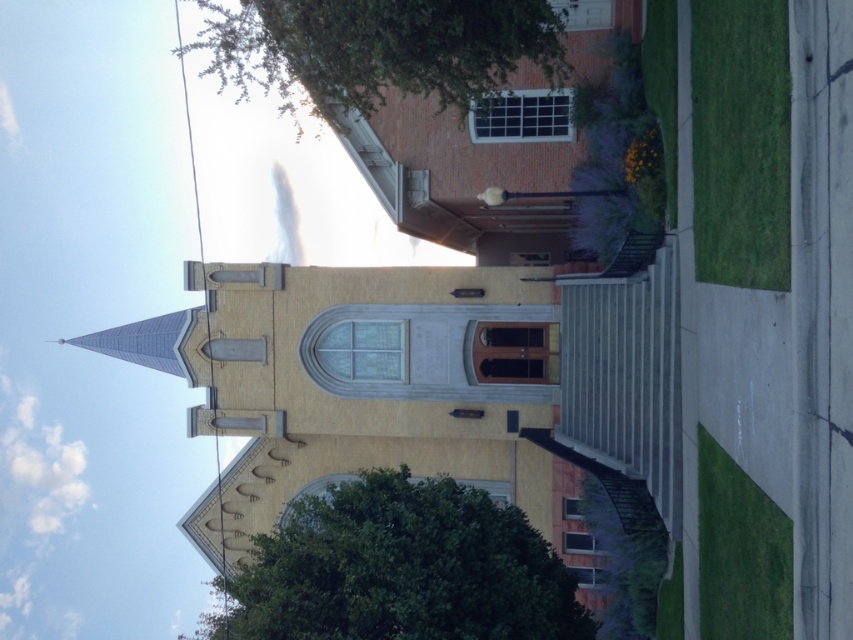
Is green leafy tree at center positioned before green leafy tree at upper center?

That is True.

This screenshot has width=853, height=640. What are the coordinates of `green leafy tree at center` in the screenshot? It's located at (399, 570).

Who is more forward, (471, 509) or (230, 70)?

Point (471, 509)

Find the location of a particular element. Image resolution: width=853 pixels, height=640 pixels. green leafy tree at center is located at coordinates (399, 570).